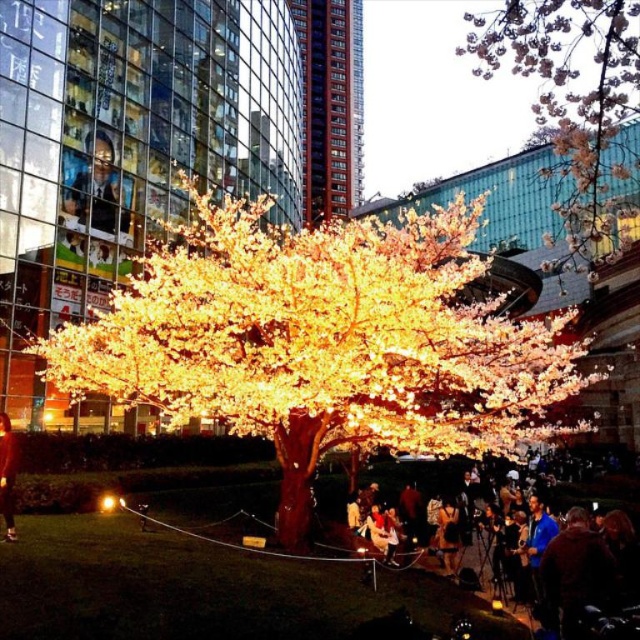
You are standing in the urban scene and want to take a photo of the illuminated plastic tree at center. If your camera can focus on objects up to 100 feet away, will you be able to capture a clear image of the tree?

The illuminated plastic tree at center is 102.12 feet from the viewer, which is beyond the camera focus limit of 100 feet. Therefore, the camera cannot capture a clear image of the tree.

Based on the photo, you are a photographer standing in front of the large tree with glowing lights. You want to capture both the matte black jacket at lower right and the smooth glass portrait at upper left in the same frame. Which object will appear larger in your photo?

The matte black jacket at lower right will appear larger in the photo because it is closer to the viewer than the smooth glass portrait at upper left.

Looking at this image, you are an art curator planning to hang a new painting in the gallery. You notice the smooth glass portrait at upper left and the matte black jacket at lower left. Which object is positioned higher in the scene?

The smooth glass portrait at upper left is positioned higher than the matte black jacket at lower left.